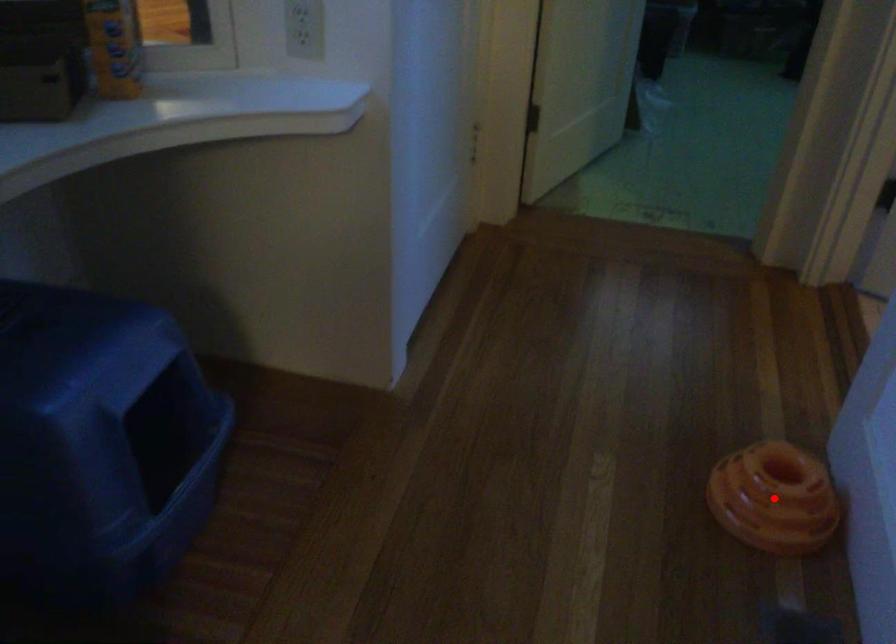
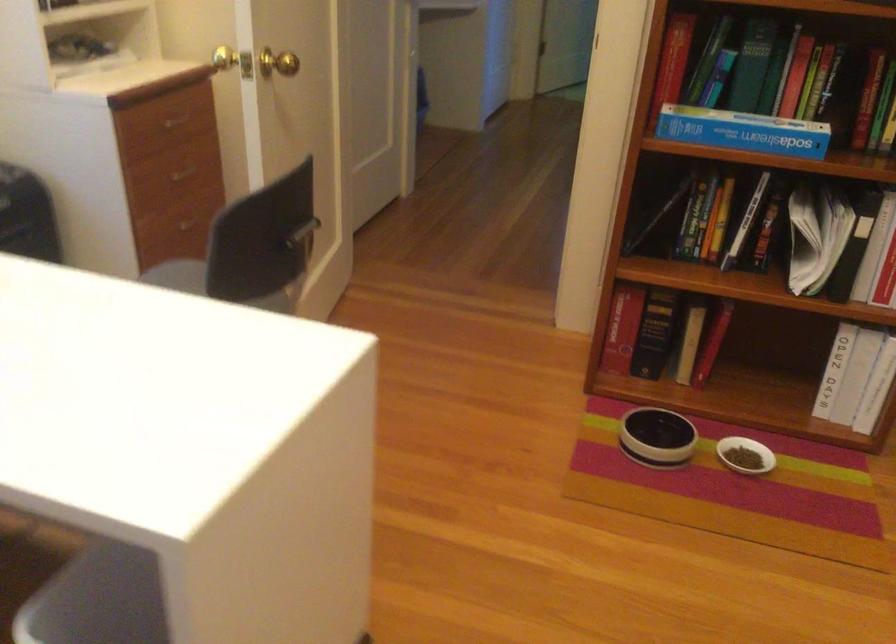
Question: I am providing you with two images of the same scene from different viewpoints. A red point is marked on the first image. Can you still see the location of the red point in image 2?

Choices:
 (A) Yes
 (B) No

Answer: (B)